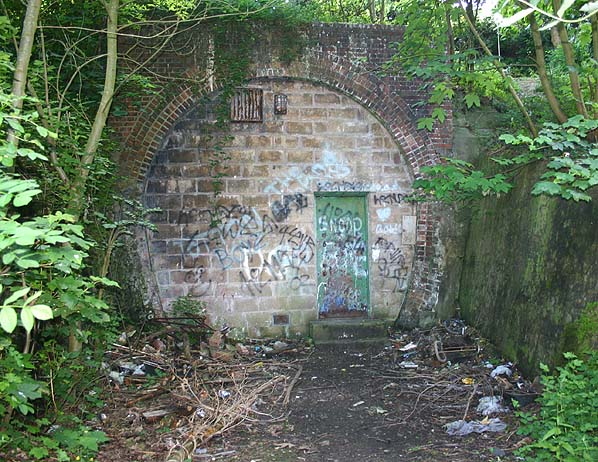
Where is `green door`? green door is located at coordinates (349, 209).